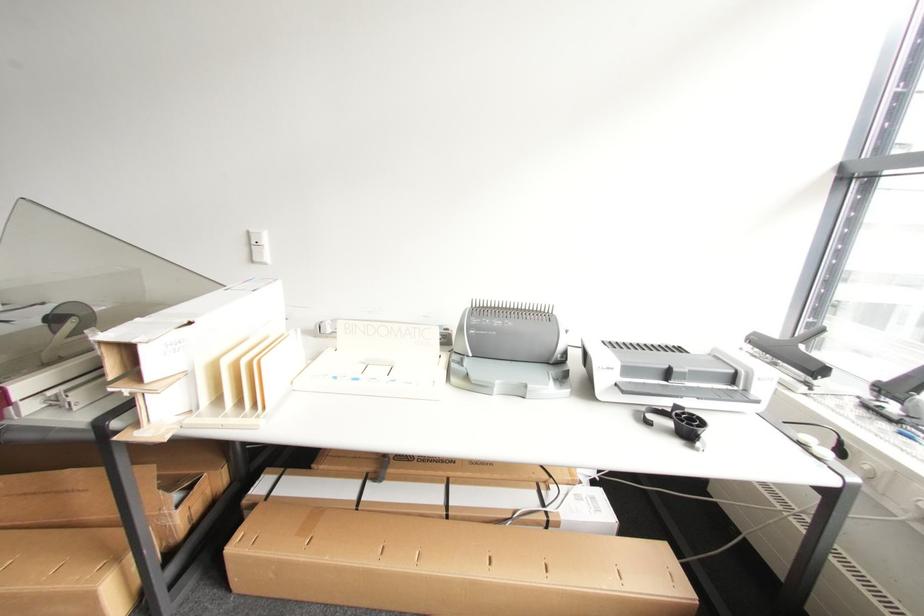
Where would you turn the grey machine wheel? Please return your answer as a coordinate pair (x, y).

(66, 325)